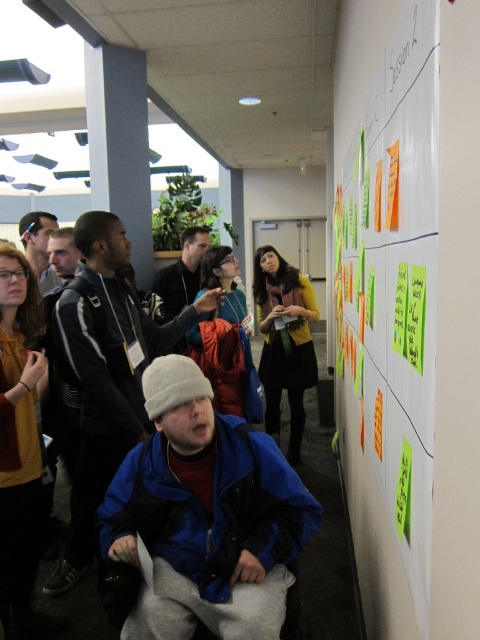
Question: Can you confirm if whiteboard with sticky notes at upper right is wider than orange scarf at center?

Choices:
 (A) yes
 (B) no

Answer: (B)

Question: Which point is farther to the camera?

Choices:
 (A) whiteboard with sticky notes at upper right
 (B) blue fleece jacket at lower center
 (C) orange scarf at center

Answer: (C)

Question: Is matte yellow shirt at left positioned at the back of yellow sweater at center?

Choices:
 (A) yes
 (B) no

Answer: (B)

Question: Does whiteboard with sticky notes at upper right lie in front of black leather jacket at center?

Choices:
 (A) no
 (B) yes

Answer: (B)

Question: Which point appears farthest from the camera in this image?

Choices:
 (A) (388, 104)
 (B) (184, 292)
 (C) (316, 368)

Answer: (C)

Question: Which point is closer to the camera?

Choices:
 (A) (397, 109)
 (B) (285, 342)

Answer: (A)